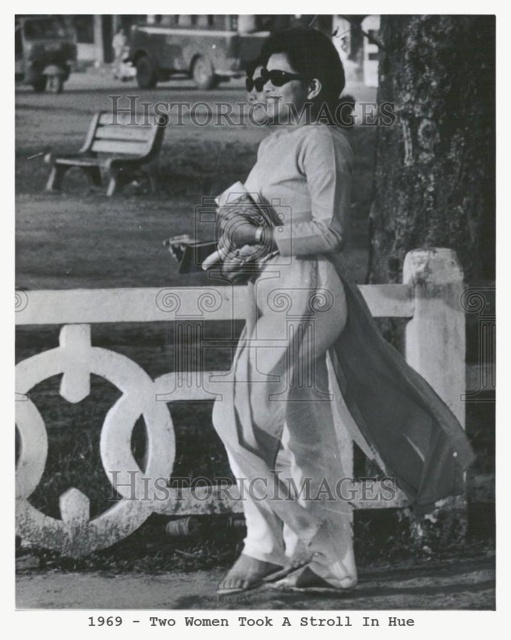
You are a photographer who wants to capture a closeup of the silky white ao dai at center without the wooden park bench at left appearing in the frame. Based on their positions, is this possible?

Yes, since the silky white ao dai at center is in front of the wooden park bench at left, you can adjust the camera angle to focus solely on the ao dai without including the bench in the shot.

Based on the scene described, which object is positioned lower in the image? The silky white ao dai at center or the wooden park bench at left?

The silky white ao dai at center is positioned lower than the wooden park bench at left in the image.

You are a photographer analyzing this historical image from 1969. You notice the silky white ao dai at center and the black plastic goggles at upper center. Which object in the image is bigger?

The silky white ao dai at center is larger in size than the black plastic goggles at upper center.